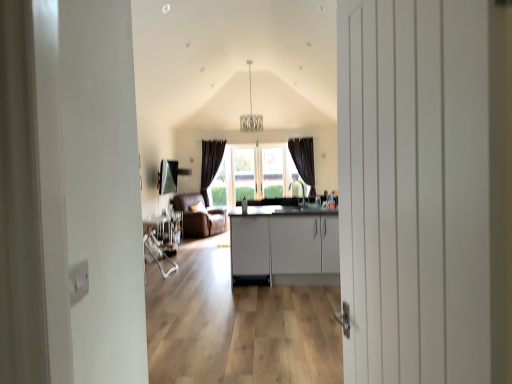
Question: Considering the positions of metallic silver table at center and white wooden door at center in the image, is metallic silver table at center taller or shorter than white wooden door at center?

Choices:
 (A) tall
 (B) short

Answer: (B)

Question: Is metallic silver table at center in front of or behind white wooden door at center in the image?

Choices:
 (A) front
 (B) behind

Answer: (B)

Question: Which object is the farthest from the white matte cabinet at center?

Choices:
 (A) white wooden door at center
 (B) metallic silver table at center
 (C) brown leather armchair at center

Answer: (A)

Question: Which object is the farthest from the white wooden door at center?

Choices:
 (A) metallic silver table at center
 (B) white matte cabinet at center
 (C) brown leather armchair at center

Answer: (C)